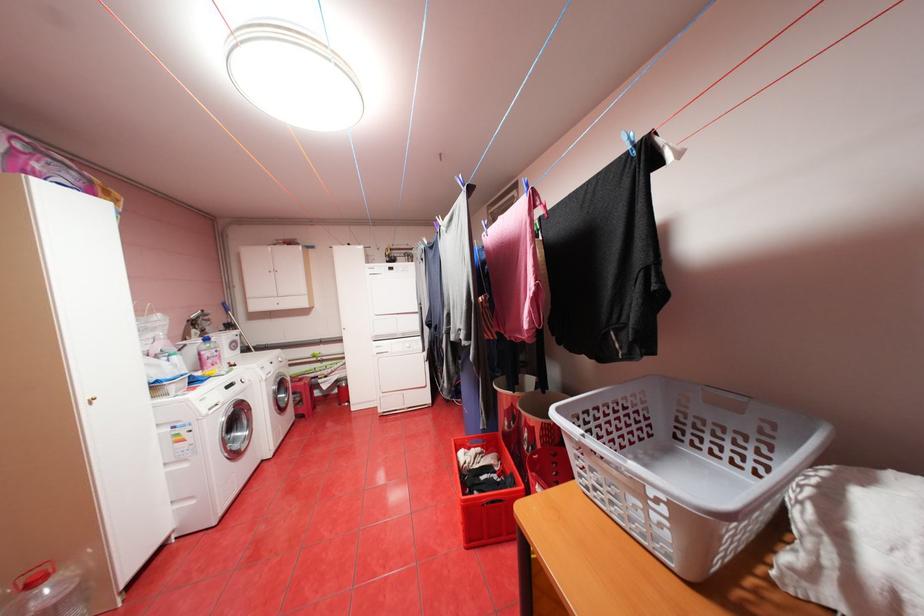
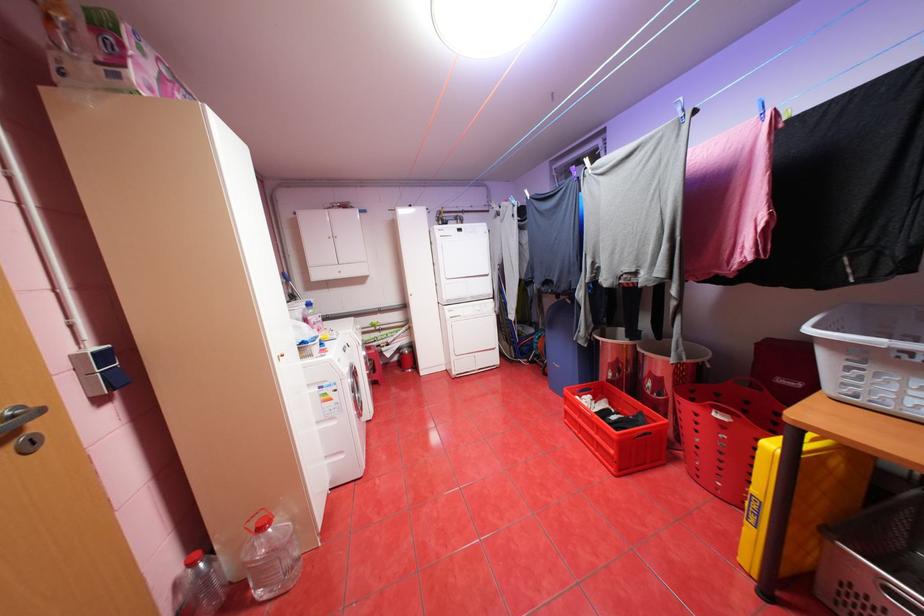
Question: Based on the continuous images, in which direction is the camera rotating? Reply with the corresponding letter.

Choices:
 (A) Left
 (B) Right
 (C) Up
 (D) Down

Answer: (D)